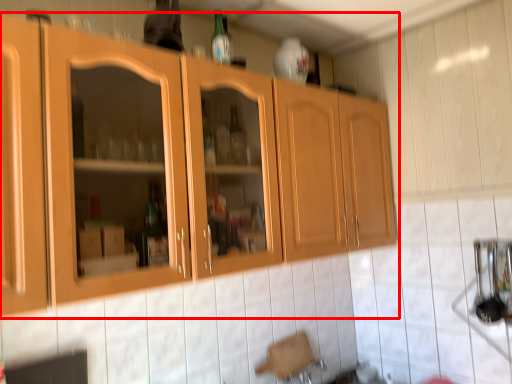
Question: From the image's perspective, where is cabinetry (annotated by the red box) located relative to bottle?

Choices:
 (A) above
 (B) below

Answer: (B)